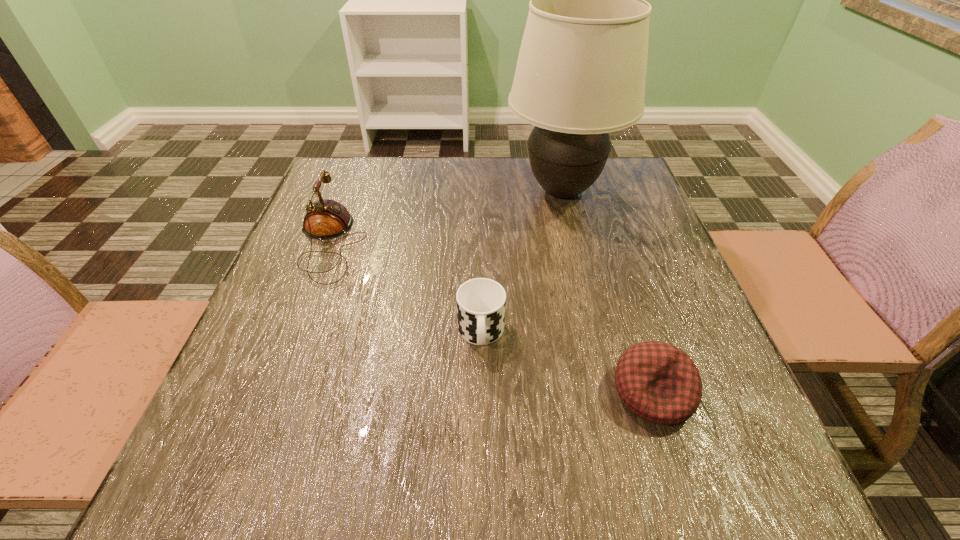
The height and width of the screenshot is (540, 960). Find the location of `free space that satisfies the following two spatial constraints: 1. on the rotary dial of the beanbag; 2. on the right side of the leftmost object`. free space that satisfies the following two spatial constraints: 1. on the rotary dial of the beanbag; 2. on the right side of the leftmost object is located at coordinates (273, 393).

The width and height of the screenshot is (960, 540). I want to click on free spot that satisfies the following two spatial constraints: 1. on the rotary dial of the beanbag; 2. on the left side of the leftmost object, so click(x=273, y=393).

You are a GUI agent. You are given a task and a screenshot of the screen. Output one action in this format:
    pyautogui.click(x=<x>, y=<y>)
    Task: Click on the vacant space that satisfies the following two spatial constraints: 1. on the side of the beanbag with the handle; 2. on the left side of the cup
    This screenshot has height=540, width=960.
    Given the screenshot: What is the action you would take?
    pyautogui.click(x=481, y=393)

I want to click on free space that satisfies the following two spatial constraints: 1. on the side of the second object from left to right with the handle; 2. on the left side of the beanbag, so click(481, 393).

Image resolution: width=960 pixels, height=540 pixels. Find the location of `vacant space that satisfies the following two spatial constraints: 1. on the side of the beanbag with the handle; 2. on the right side of the third object from right to left`. vacant space that satisfies the following two spatial constraints: 1. on the side of the beanbag with the handle; 2. on the right side of the third object from right to left is located at coordinates (481, 393).

At what (x,y) coordinates should I click in order to perform the action: click on free space that satisfies the following two spatial constraints: 1. on the front side of the tallest object; 2. on the left side of the beanbag. Please return your answer as a coordinate pair (x, y). The image size is (960, 540). Looking at the image, I should click on (611, 393).

Find the location of a particular element. The width and height of the screenshot is (960, 540). vacant space that satisfies the following two spatial constraints: 1. on the rotary dial of the telephone; 2. on the left side of the beanbag is located at coordinates (273, 393).

At what (x,y) coordinates should I click in order to perform the action: click on vacant space that satisfies the following two spatial constraints: 1. on the side of the beanbag with the handle; 2. on the left side of the cup. Please return your answer as a coordinate pair (x, y). Looking at the image, I should click on (481, 393).